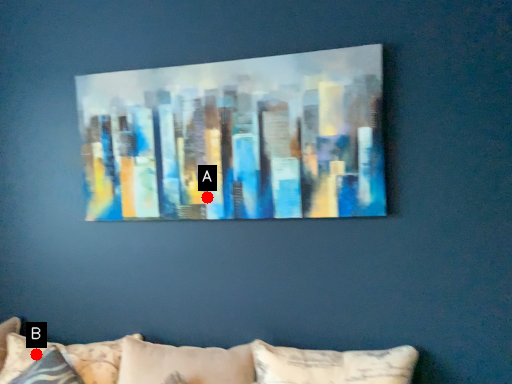
Question: Two points are circled on the image, labeled by A and B beside each circle. Which point is closer to the camera taking this photo?

Choices:
 (A) A is closer
 (B) B is closer

Answer: (A)